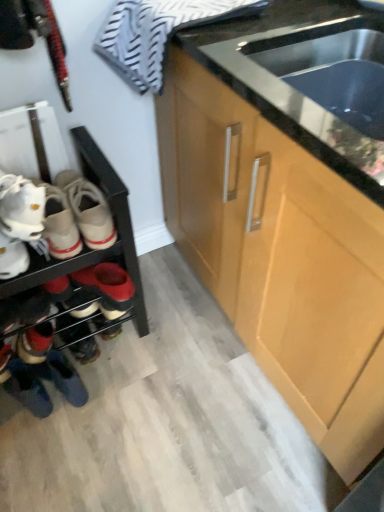
Question: Is leather sneakers at lower left, marked as the 2th footwear in a top-to-bottom arrangement, not within striped cotton towel at upper left?

Choices:
 (A) yes
 (B) no

Answer: (A)

Question: Does leather sneakers at lower left, marked as the 2th footwear in a top-to-bottom arrangement, appear on the left side of striped cotton towel at upper left?

Choices:
 (A) no
 (B) yes

Answer: (B)

Question: Does leather sneakers at lower left, marked as the 2th footwear in a top-to-bottom arrangement, turn towards striped cotton towel at upper left?

Choices:
 (A) yes
 (B) no

Answer: (B)

Question: Considering the relative sizes of leather sneakers at lower left, the first footwear positioned from the bottom, and striped cotton towel at upper left in the image provided, is leather sneakers at lower left, the first footwear positioned from the bottom, thinner than striped cotton towel at upper left?

Choices:
 (A) yes
 (B) no

Answer: (A)

Question: Can you confirm if leather sneakers at lower left, the 1th footwear in the back-to-front sequence, is positioned to the right of striped cotton towel at upper left?

Choices:
 (A) yes
 (B) no

Answer: (B)

Question: Is stainless steel sink at center wider or thinner than leather sneakers at lower left, which is the 2th footwear from front to back?

Choices:
 (A) wide
 (B) thin

Answer: (A)

Question: Do you think stainless steel sink at center is within leather sneakers at lower left, the first footwear positioned from the bottom, or outside of it?

Choices:
 (A) outside
 (B) inside

Answer: (A)

Question: From a real-world perspective, is stainless steel sink at center above or below leather sneakers at lower left, marked as the 2th footwear in a top-to-bottom arrangement?

Choices:
 (A) below
 (B) above

Answer: (B)

Question: Considering the positions of stainless steel sink at center and leather sneakers at lower left, the first footwear positioned from the bottom, in the image, is stainless steel sink at center taller or shorter than leather sneakers at lower left, the first footwear positioned from the bottom,?

Choices:
 (A) short
 (B) tall

Answer: (B)

Question: Considering the positions of stainless steel sink at center and matte wood cabinet at center in the image, is stainless steel sink at center taller or shorter than matte wood cabinet at center?

Choices:
 (A) short
 (B) tall

Answer: (A)

Question: From a real-world perspective, is stainless steel sink at center positioned above or below matte wood cabinet at center?

Choices:
 (A) below
 (B) above

Answer: (B)

Question: In the image, is stainless steel sink at center on the left side or the right side of matte wood cabinet at center?

Choices:
 (A) left
 (B) right

Answer: (A)

Question: Relative to matte wood cabinet at center, is stainless steel sink at center in front or behind?

Choices:
 (A) front
 (B) behind

Answer: (B)

Question: From a real-world perspective, is white matte shoes at left, the second footwear ordered from the bottom, above or below stainless steel sink at center?

Choices:
 (A) below
 (B) above

Answer: (A)

Question: Based on their sizes in the image, would you say white matte shoes at left, the second footwear ordered from the bottom, is bigger or smaller than stainless steel sink at center?

Choices:
 (A) big
 (B) small

Answer: (B)